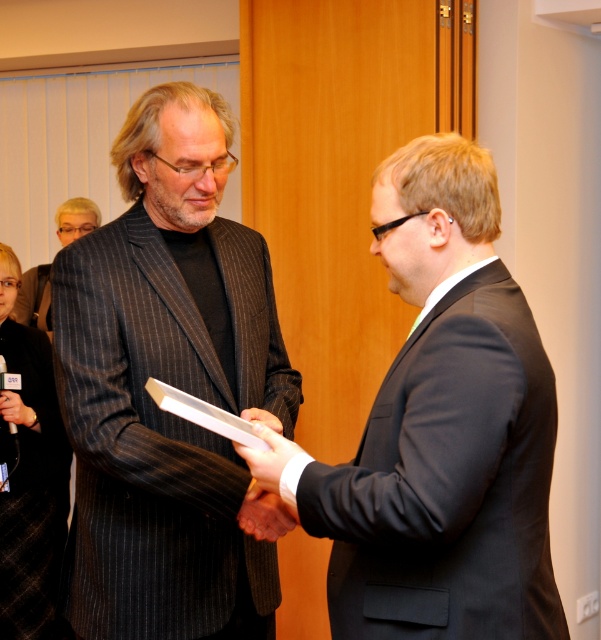
You are an event planner organizing a ceremony. You need to ensure that the black pinstripe suit at lower left and the white paper at center are visible to all attendees. Given their height difference, which object will require a higher placement on the stage to ensure visibility?

The white paper at center is shorter than the black pinstripe suit at lower left, so it will require higher placement on the stage to ensure visibility.

You are standing at the point labeled point (439, 342) and want to greet someone who is 4.16 feet away from you. Can you determine if the person you want to greet is within a comfortable greeting distance?

The point labeled point (439, 342) and the viewer are 4.16 feet apart, so the person is within a comfortable greeting distance since 4.16 feet is a typical distance for greeting someone.